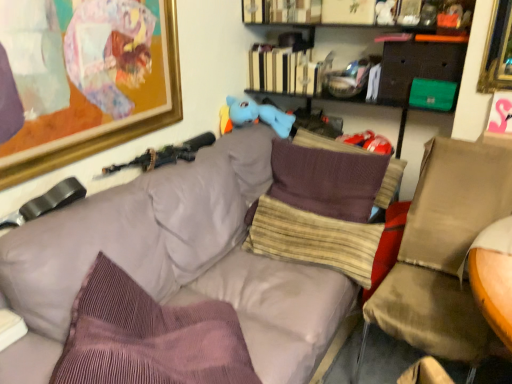
Question: Looking at their shapes, would you say brown fabric swivel chair at right is wider or thinner than purple corduroy pillow at center, the first pillow positioned from the front?

Choices:
 (A) wide
 (B) thin

Answer: (A)

Question: Looking at the image, does brown fabric swivel chair at right seem bigger or smaller compared to purple corduroy pillow at center, which is counted as the third pillow, starting from the back?

Choices:
 (A) small
 (B) big

Answer: (A)

Question: Estimate the real-world distances between objects in this image. Which object is farther from the purple corduroy pillow at center, which is counted as the third pillow, starting from the back?

Choices:
 (A) gold-framed artwork at upper left
 (B) brown fabric swivel chair at right
 (C) hardcover book at upper center
 (D) black plastic rifle at upper left
 (E) wooden bookshelf at upper center

Answer: (E)

Question: Which object is the closest to the purple ribbed pillow at center, arranged as the 1th pillow when viewed from the back?

Choices:
 (A) matte gray couch at center
 (B) purple corduroy pillow at center, the first pillow positioned from the front
 (C) brown fabric swivel chair at right
 (D) gold-framed artwork at upper left
 (E) matte black drawer at upper right

Answer: (E)